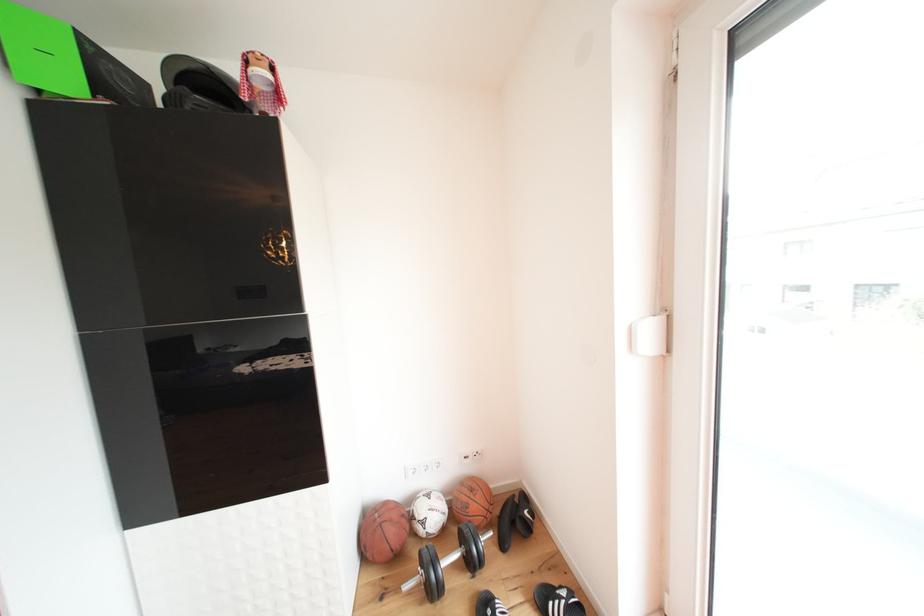
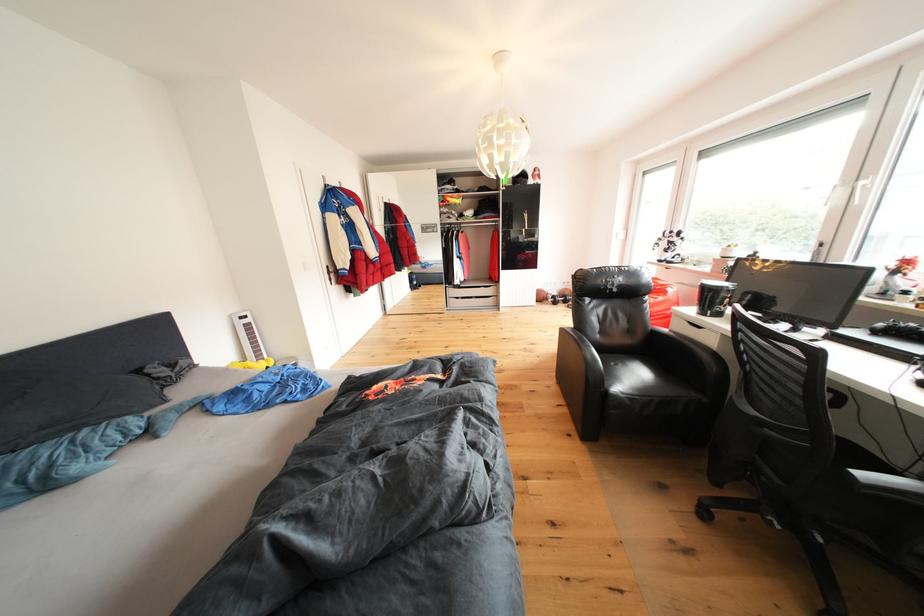
Question: In a continuous first-person perspective shot, in which direction is the camera moving?

Choices:
 (A) Left
 (B) Right
 (C) Forward
 (D) Backward

Answer: (D)